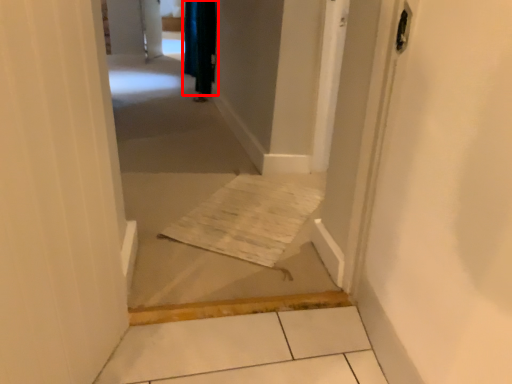
Question: From the image's perspective, what is the correct spatial relationship of curtain (annotated by the red box) in relation to corridor?

Choices:
 (A) below
 (B) above

Answer: (B)